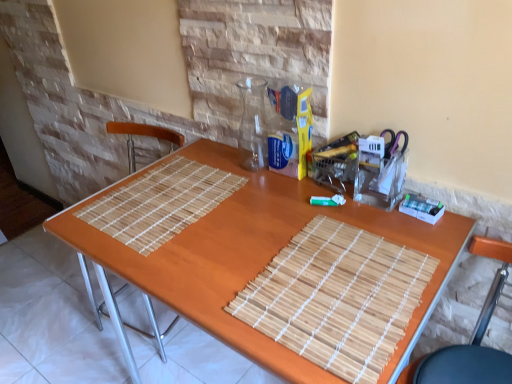
I want to click on vacant space situated above wooden table at center (from a real-world perspective), so click(256, 225).